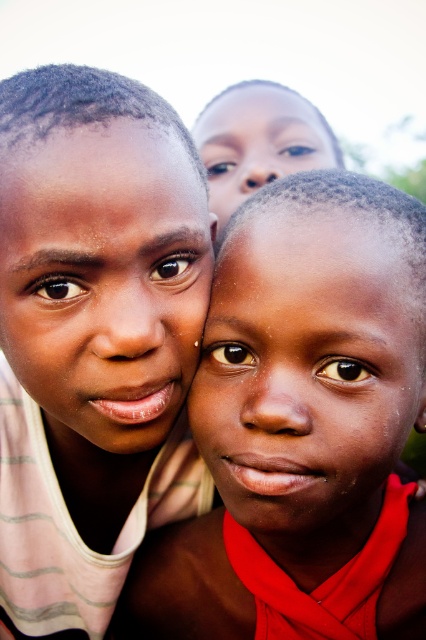
This screenshot has height=640, width=426. What do you see at coordinates (302, 428) in the screenshot?
I see `smooth skin child at center` at bounding box center [302, 428].

Which is in front, point (348, 272) or point (34, 346)?

Point (348, 272) is more forward.

Who is more distant from viewer, (385, 380) or (20, 193)?

Point (385, 380)

Where is `smooth skin child at center`? The image size is (426, 640). smooth skin child at center is located at coordinates (302, 428).

Is smooth skin child at center below smooth skin face at center?

Yes, smooth skin child at center is below smooth skin face at center.

Does smooth skin child at center have a lesser height compared to smooth skin face at center?

In fact, smooth skin child at center may be taller than smooth skin face at center.

Find the location of a particular element. Image resolution: width=426 pixels, height=640 pixels. smooth skin child at center is located at coordinates (302, 428).

Consider the image. Between matte skin face at center and smooth skin face at upper center, which one has less height?

Standing shorter between the two is matte skin face at center.

Which is above, matte skin face at center or smooth skin face at upper center?

smooth skin face at upper center

Which is in front, point (115, 211) or point (279, 96)?

Point (115, 211)

What are the coordinates of `matte skin face at center` in the screenshot? It's located at (104, 276).